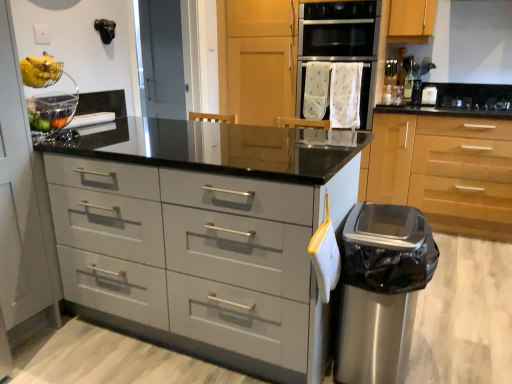
Measure the distance between black glass gas stove at upper right and camera.

black glass gas stove at upper right and camera are 3.12 meters apart from each other.

Where is `black glass gas stove at upper right`? The image size is (512, 384). black glass gas stove at upper right is located at coordinates (475, 101).

This screenshot has height=384, width=512. Describe the element at coordinates (429, 96) in the screenshot. I see `satin black oven at upper center` at that location.

Measure the distance between yellow matte bananas at upper left and camera.

1.75 meters.

Identify the location of matte gray drawers at center. (204, 235).

This screenshot has width=512, height=384. I want to click on black glass gas stove at upper right, so pyautogui.click(x=475, y=101).

From the picture: Is black glass gas stove at upper right far away from stainless steel trash can at lower right?

Absolutely, black glass gas stove at upper right is distant from stainless steel trash can at lower right.

Can we say black glass gas stove at upper right lies outside stainless steel trash can at lower right?

black glass gas stove at upper right lies outside stainless steel trash can at lower right's area.

You are a GUI agent. You are given a task and a screenshot of the screen. Output one action in this format:
    pyautogui.click(x=<x>, y=<y>)
    Task: Click on the garbage lying below the black glass gas stove at upper right (from the image's perspective)
    Image resolution: width=512 pixels, height=384 pixels.
    Given the screenshot: What is the action you would take?
    pyautogui.click(x=381, y=291)

Considering the positions of points (455, 100) and (362, 369), is point (455, 100) closer to camera compared to point (362, 369)?

No, (455, 100) is behind (362, 369).

Is yellow matte bananas at upper left facing away from white fabric oven at center?

No, yellow matte bananas at upper left is not facing the opposite direction of white fabric oven at center.

Based on their positions, is yellow matte bananas at upper left located to the left or right of white fabric oven at center?

From the image, it's evident that yellow matte bananas at upper left is to the left of white fabric oven at center.

From the picture: Does yellow matte bananas at upper left touch white fabric oven at center?

No, yellow matte bananas at upper left is not next to white fabric oven at center.

Considering the sizes of objects yellow matte bananas at upper left and white fabric oven at center in the image provided, who is shorter, yellow matte bananas at upper left or white fabric oven at center?

Standing shorter between the two is yellow matte bananas at upper left.

Between wooden cabinet at right and yellow matte bananas at upper left, which one is positioned in front?

Positioned in front is yellow matte bananas at upper left.

Is wooden cabinet at right in contact with yellow matte bananas at upper left?

No, wooden cabinet at right is not next to yellow matte bananas at upper left.

Looking at their sizes, would you say wooden cabinet at right is wider or thinner than yellow matte bananas at upper left?

wooden cabinet at right is wider than yellow matte bananas at upper left.

Is wooden cabinet at right bigger than yellow matte bananas at upper left?

Correct, wooden cabinet at right is larger in size than yellow matte bananas at upper left.

From a real-world perspective, is stainless steel trash can at lower right above or below satin black oven at upper center?

In terms of real-world spatial position, stainless steel trash can at lower right is below satin black oven at upper center.

Is stainless steel trash can at lower right oriented away from satin black oven at upper center?

No, stainless steel trash can at lower right is not facing the opposite direction of satin black oven at upper center.

Is stainless steel trash can at lower right far from satin black oven at upper center?

Absolutely, stainless steel trash can at lower right is distant from satin black oven at upper center.

From a real-world perspective, is satin black oven at upper center positioned above or below matte gray drawers at center?

From a real-world perspective, satin black oven at upper center is physically above matte gray drawers at center.

Is satin black oven at upper center smaller than matte gray drawers at center?

Indeed, satin black oven at upper center has a smaller size compared to matte gray drawers at center.

Could you tell me if satin black oven at upper center is turned towards matte gray drawers at center?

No, satin black oven at upper center is not facing towards matte gray drawers at center.

Is matte gray drawers at center inside satin black oven at upper center?

That's incorrect, matte gray drawers at center is not inside satin black oven at upper center.

From the picture: Could you tell me if yellow matte bananas at upper left is turned towards wooden cabinet at right?

No, yellow matte bananas at upper left is not facing towards wooden cabinet at right.

In the scene shown: Can you tell me how much yellow matte bananas at upper left and wooden cabinet at right differ in facing direction?

85.5 degrees separate the facing orientations of yellow matte bananas at upper left and wooden cabinet at right.

Which is in front, yellow matte bananas at upper left or wooden cabinet at right?

yellow matte bananas at upper left is closer to the camera.

Is yellow matte bananas at upper left smaller than wooden cabinet at right?

Yes, yellow matte bananas at upper left is smaller than wooden cabinet at right.

Considering their positions, is stainless steel oven at upper center located in front of or behind wooden cabinet at right?

In the image, stainless steel oven at upper center appears behind wooden cabinet at right.

Which object is wider, stainless steel oven at upper center or wooden cabinet at right?

With larger width is wooden cabinet at right.

Looking at this image, from a real-world perspective, is stainless steel oven at upper center physically above wooden cabinet at right?

Yes, from a real-world perspective, stainless steel oven at upper center is on top of wooden cabinet at right.

Is stainless steel oven at upper center aimed at wooden cabinet at right?

No, stainless steel oven at upper center is not facing towards wooden cabinet at right.

Locate an element on the screen. garbage on the left of black glass gas stove at upper right is located at coordinates (381, 291).

Where is `oven behind the yellow matte bananas at upper left`? oven behind the yellow matte bananas at upper left is located at coordinates (340, 44).

Estimate the real-world distances between objects in this image. Which object is closer to white fabric oven at center, yellow matte bananas at upper left or stainless steel trash can at lower right?

stainless steel trash can at lower right is positioned closer to the anchor white fabric oven at center.

Looking at this image, when comparing their distances from wooden cabinet at right, does satin black oven at upper center or yellow matte bananas at upper left seem closer?

satin black oven at upper center.

Considering their positions, is wooden cabinet at right positioned further to white fabric oven at center than black glass gas stove at upper right?

black glass gas stove at upper right is positioned further to the anchor white fabric oven at center.

Estimate the real-world distances between objects in this image. Which object is closer to black glass gas stove at upper right, matte gray drawers at center or yellow matte bananas at upper left?

matte gray drawers at center is positioned closer to the anchor black glass gas stove at upper right.

Based on their spatial positions, is satin black oven at upper center or black glass gas stove at upper right further from white fabric oven at center?

Based on the image, black glass gas stove at upper right appears to be further to white fabric oven at center.

Considering their positions, is wooden cabinet at right positioned further to stainless steel trash can at lower right than satin black oven at upper center?

satin black oven at upper center lies further to stainless steel trash can at lower right than the other object.

Estimate the real-world distances between objects in this image. Which object is closer to black glass gas stove at upper right, stainless steel trash can at lower right or white fabric oven at center?

white fabric oven at center lies closer to black glass gas stove at upper right than the other object.

When comparing their distances from stainless steel trash can at lower right, does white fabric oven at center or wooden cabinet at right seem closer?

Among the two, wooden cabinet at right is located nearer to stainless steel trash can at lower right.

The height and width of the screenshot is (384, 512). I want to click on garbage situated between yellow matte bananas at upper left and stainless steel oven at upper center from left to right, so click(381, 291).

At what (x,y) coordinates should I click in order to perform the action: click on cabinetry between matte gray drawers at center and black glass gas stove at upper right from left to right. Please return your answer as a coordinate pair (x, y). This screenshot has width=512, height=384. Looking at the image, I should click on (444, 171).

The height and width of the screenshot is (384, 512). In order to click on home appliance between yellow matte bananas at upper left and satin black oven at upper center from left to right in this screenshot , I will do `click(339, 29)`.

I want to click on garbage between yellow matte bananas at upper left and wooden cabinet at right in the horizontal direction, so click(x=381, y=291).